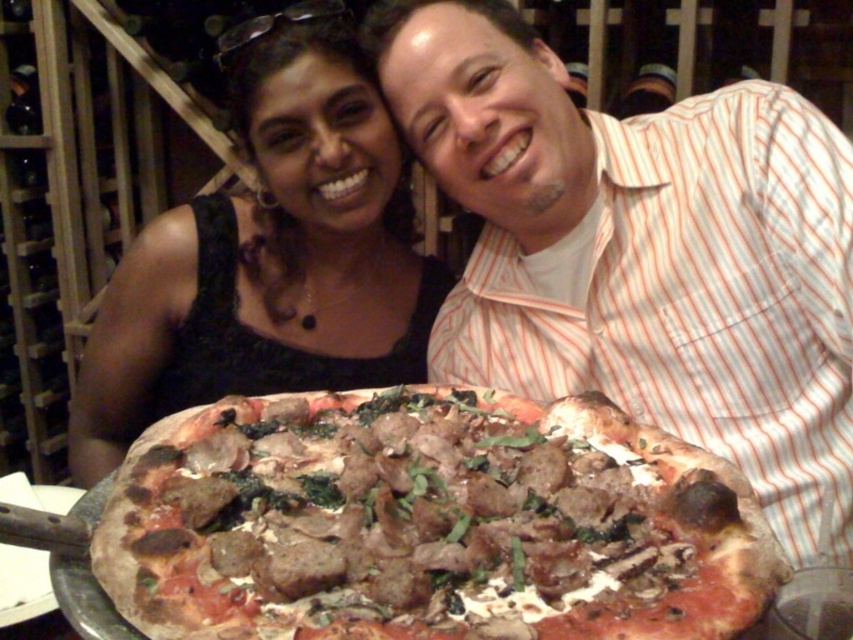
Question: Is golden-brown crusty pizza at center thinner than black lace dress at upper left?

Choices:
 (A) yes
 (B) no

Answer: (A)

Question: Among these objects, which one is farthest from the camera?

Choices:
 (A) golden-brown crusty pizza at center
 (B) striped shirt at center

Answer: (B)

Question: Which object appears closest to the camera in this image?

Choices:
 (A) striped shirt at center
 (B) golden-brown crusty pizza at center
 (C) black lace dress at upper left

Answer: (B)

Question: Which of these objects is positioned farthest from the striped shirt at center?

Choices:
 (A) black lace dress at upper left
 (B) golden-brown crusty pizza at center

Answer: (B)

Question: In this image, where is golden-brown crusty pizza at center located relative to black lace dress at upper left?

Choices:
 (A) above
 (B) below

Answer: (B)

Question: Does golden-brown crusty pizza at center have a larger size compared to black lace dress at upper left?

Choices:
 (A) yes
 (B) no

Answer: (B)